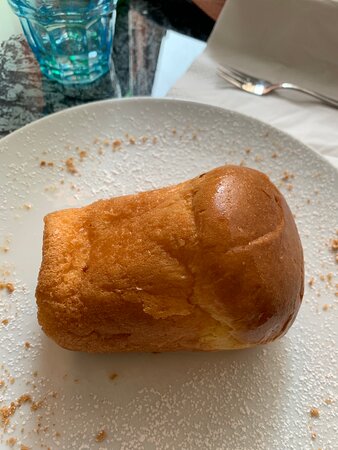
Where is `napkin`? napkin is located at coordinates (255, 37).